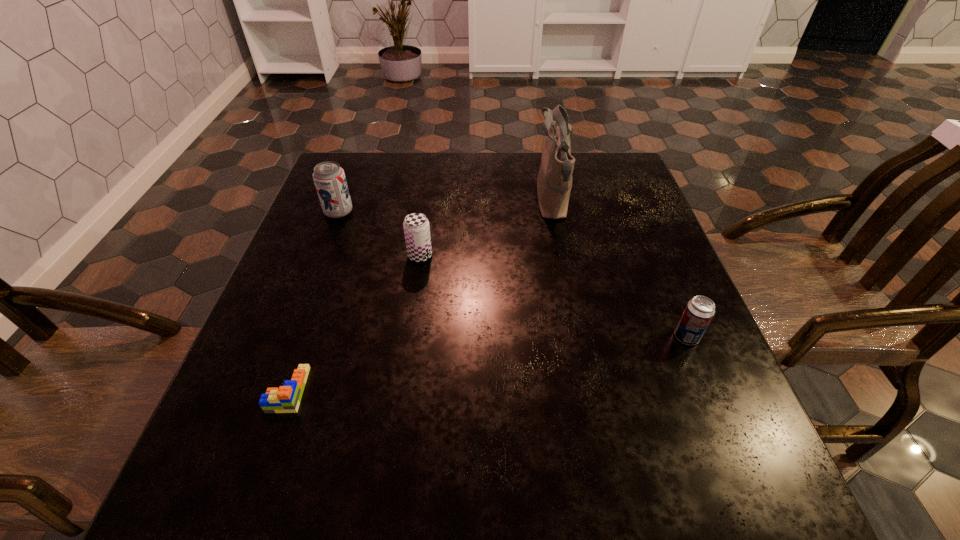
Where is `free space that satisfies the following two spatial constraints: 1. on the front-facing side of the rightmost beer can; 2. on the left side of the shoulder bag`? free space that satisfies the following two spatial constraints: 1. on the front-facing side of the rightmost beer can; 2. on the left side of the shoulder bag is located at coordinates (579, 337).

In order to click on vacant space that satisfies the following two spatial constraints: 1. on the front-facing side of the shoulder bag; 2. on the left side of the fourth farthest object in this screenshot , I will do click(x=579, y=337).

Find the location of `free space that satisfies the following two spatial constraints: 1. on the front side of the fourth shortest object; 2. on the left side of the nearest object`. free space that satisfies the following two spatial constraints: 1. on the front side of the fourth shortest object; 2. on the left side of the nearest object is located at coordinates (273, 389).

Find the location of a particular element. The width and height of the screenshot is (960, 540). vacant region that satisfies the following two spatial constraints: 1. on the back side of the Lego; 2. on the left side of the rightmost beer can is located at coordinates (307, 337).

Locate an element on the screen. This screenshot has width=960, height=540. free spot that satisfies the following two spatial constraints: 1. on the front-facing side of the shoulder bag; 2. on the front side of the second beer can from right to left is located at coordinates (563, 256).

Locate an element on the screen. free point that satisfies the following two spatial constraints: 1. on the front-facing side of the fourth object from left to right; 2. on the back side of the fourth farthest object is located at coordinates (579, 337).

Find the location of a particular element. The height and width of the screenshot is (540, 960). free space in the image that satisfies the following two spatial constraints: 1. on the front-facing side of the shoulder bag; 2. on the back side of the rightmost object is located at coordinates (579, 337).

Where is `free space that satisfies the following two spatial constraints: 1. on the front-facing side of the rightmost beer can; 2. on the left side of the second object from right to left`? The image size is (960, 540). free space that satisfies the following two spatial constraints: 1. on the front-facing side of the rightmost beer can; 2. on the left side of the second object from right to left is located at coordinates point(579,337).

Identify the location of vacant area that satisfies the following two spatial constraints: 1. on the front side of the tallest beer can; 2. on the left side of the nearest object. (273, 389).

Identify the location of vacant space that satisfies the following two spatial constraints: 1. on the front-facing side of the shoulder bag; 2. on the right side of the nearest beer can. This screenshot has height=540, width=960. (579, 337).